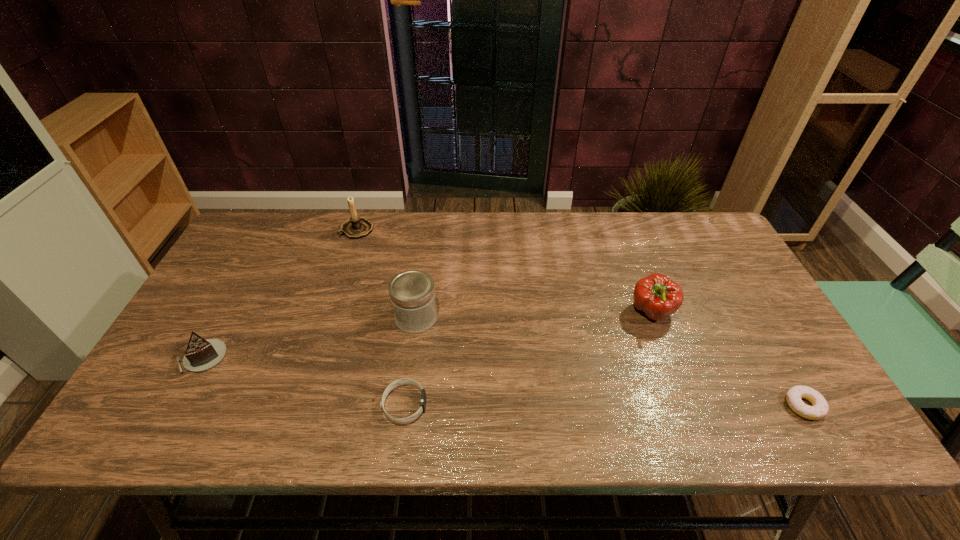
You are a GUI agent. You are given a task and a screenshot of the screen. Output one action in this format:
    pyautogui.click(x=<x>, y=<y>)
    Task: Click on the vacant space that's between the shortest object and the leftmost object
    The width and height of the screenshot is (960, 540).
    Given the screenshot: What is the action you would take?
    pyautogui.click(x=503, y=381)

Where is `vacant space that's between the fifth tallest object and the jar`? This screenshot has height=540, width=960. vacant space that's between the fifth tallest object and the jar is located at coordinates (410, 361).

Image resolution: width=960 pixels, height=540 pixels. Identify the location of free spot between the doughnut and the fifth tallest object. (604, 406).

Find the location of a particular element. Image resolution: width=960 pixels, height=540 pixels. empty space that is in between the fifth tallest object and the pepper is located at coordinates (528, 359).

Image resolution: width=960 pixels, height=540 pixels. What are the coordinates of `empty space that is in between the jar and the third nearest object` in the screenshot? It's located at (309, 337).

Where is `vacant area that lies between the fifth object from right to left and the jar`? vacant area that lies between the fifth object from right to left and the jar is located at coordinates (387, 273).

Locate an element on the screen. The height and width of the screenshot is (540, 960). object that stands as the fourth closest to the second shortest object is located at coordinates (356, 227).

Identify which object is the fifth nearest to the fifth object from right to left. Please provide its 2D coordinates. Your answer should be formatted as a tuple, i.e. [(x, y)], where the tuple contains the x and y coordinates of a point satisfying the conditions above.

[(818, 410)]

This screenshot has width=960, height=540. Identify the location of free spot that satisfies the following two spatial constraints: 1. on the back side of the leftmost object; 2. on the right side of the jar. (224, 318).

Find the location of a particular element. vacant space that satisfies the following two spatial constraints: 1. on the front side of the jar; 2. on the left side of the farthest object is located at coordinates (329, 318).